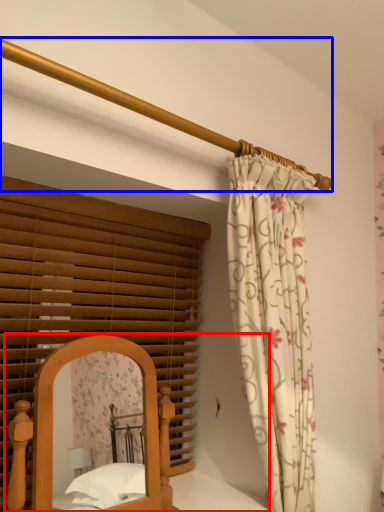
Question: Which point is further to the camera, bed (highlighted by a red box) or balustrade (highlighted by a blue box)?

Choices:
 (A) bed
 (B) balustrade

Answer: (A)